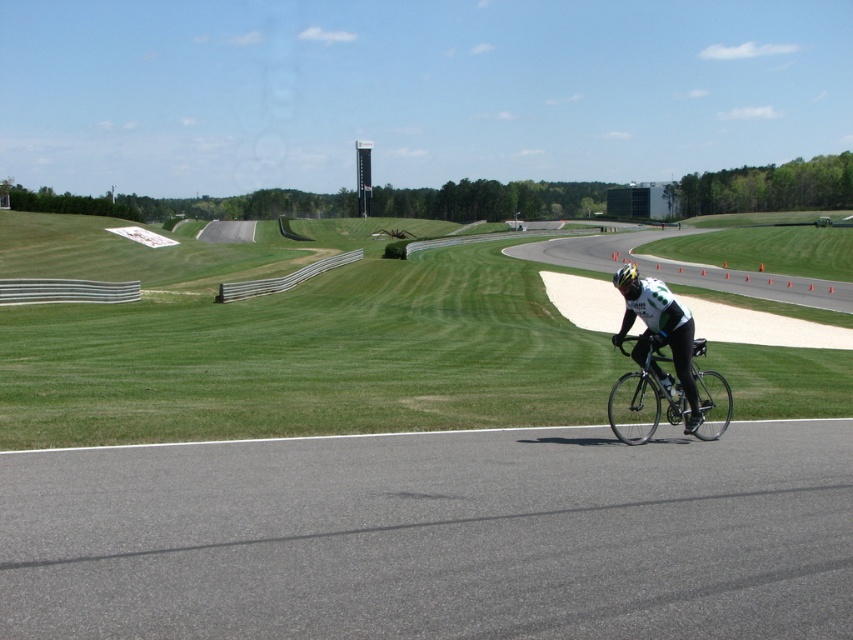
Question: Does green grass at center appear under green jersey at center?

Choices:
 (A) no
 (B) yes

Answer: (A)

Question: Considering the relative positions of gray asphalt road at center and shiny silver bicycle at center in the image provided, where is gray asphalt road at center located with respect to shiny silver bicycle at center?

Choices:
 (A) below
 (B) above

Answer: (A)

Question: Which point is closer to the camera taking this photo?

Choices:
 (A) (94, 417)
 (B) (664, 304)

Answer: (B)

Question: Which point is farther to the camera?

Choices:
 (A) white matte bicycle helmet at center
 (B) green jersey at center

Answer: (A)

Question: Can you confirm if green grass at center is smaller than green jersey at center?

Choices:
 (A) yes
 (B) no

Answer: (B)

Question: Which of the following is the closest to the observer?

Choices:
 (A) (639, 285)
 (B) (136, 593)

Answer: (B)